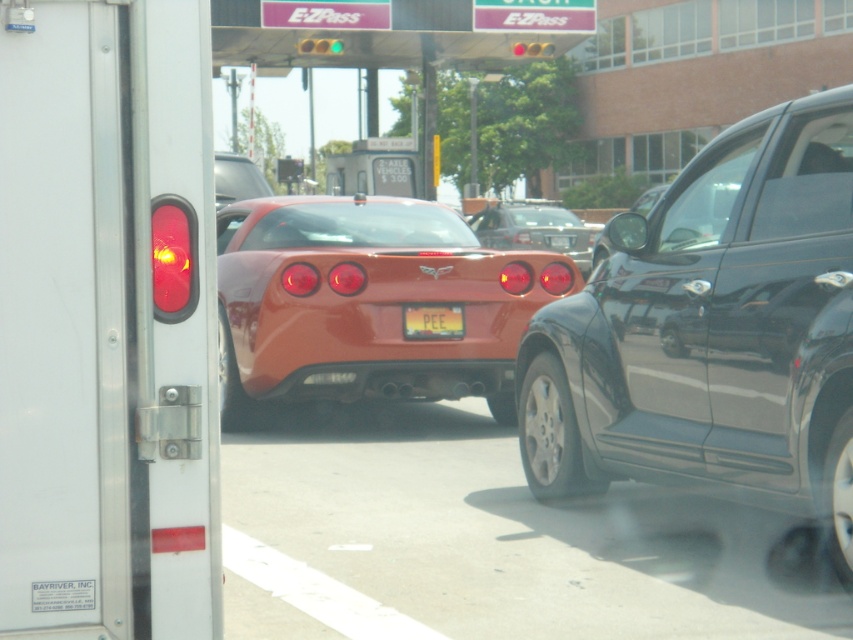
Question: Can you confirm if yellow plastic license plate at center is positioned below glossy black car at center?

Choices:
 (A) no
 (B) yes

Answer: (B)

Question: Which point appears farthest from the camera in this image?

Choices:
 (A) (550, 45)
 (B) (718, 186)
 (C) (433, 310)

Answer: (A)

Question: Does shiny orange car at center have a greater width compared to glossy black car at center?

Choices:
 (A) yes
 (B) no

Answer: (B)

Question: Among these objects, which one is nearest to the camera?

Choices:
 (A) shiny orange car at center
 (B) glossy black car at center
 (C) yellow plastic license plate at center
 (D) matte red taillight at left

Answer: (D)

Question: Which object is farther from the camera taking this photo?

Choices:
 (A) green glass traffic light at upper center
 (B) shiny orange car at center
 (C) red glass traffic light at center
 (D) glossy black car at center

Answer: (C)

Question: Is shiny orange car at center below glossy black car at center?

Choices:
 (A) yes
 (B) no

Answer: (A)